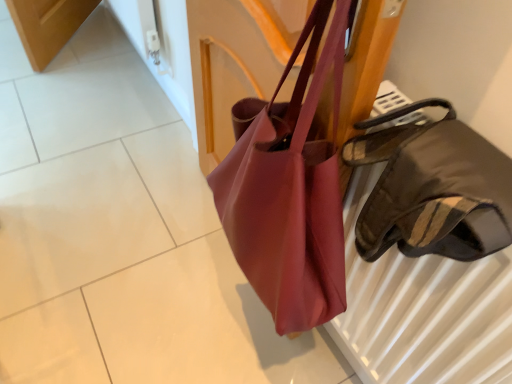
Describe the element at coordinates (290, 192) in the screenshot. I see `matte pink tote at center, the second handbag in the front-to-back sequence` at that location.

I want to click on matte pink fabric bag at center, so click(200, 324).

Would you say matte pink fabric bag at center is part of satin brown handbag at right, which appears as the 2th handbag when viewed from the back,'s contents?

No, satin brown handbag at right, which appears as the 2th handbag when viewed from the back, does not contain matte pink fabric bag at center.

From the picture: From the image's perspective, between satin brown handbag at right, marked as the second handbag in a left-to-right arrangement, and matte pink fabric bag at center, who is located below?

matte pink fabric bag at center is shown below in the image.

Is satin brown handbag at right, which appears as the 2th handbag when viewed from the back, taller or shorter than matte pink fabric bag at center?

Considering their sizes, satin brown handbag at right, which appears as the 2th handbag when viewed from the back, has more height than matte pink fabric bag at center.

Considering the sizes of objects matte pink tote at center, marked as the 1th handbag in a left-to-right arrangement, and satin brown handbag at right, marked as the second handbag in a left-to-right arrangement, in the image provided, who is thinner, matte pink tote at center, marked as the 1th handbag in a left-to-right arrangement, or satin brown handbag at right, marked as the second handbag in a left-to-right arrangement,?

Thinner between the two is matte pink tote at center, marked as the 1th handbag in a left-to-right arrangement.

Is point (240, 219) positioned before point (450, 234)?

No, (240, 219) is further to viewer.

Is matte pink tote at center, the second handbag when ordered from right to left, far from satin brown handbag at right, positioned as the 1th handbag in right-to-left order?

No, there isn't a large distance between matte pink tote at center, the second handbag when ordered from right to left, and satin brown handbag at right, positioned as the 1th handbag in right-to-left order.

Consider the image. Is matte pink tote at center, the first handbag positioned from the back, closer to the viewer compared to satin brown handbag at right, marked as the second handbag in a left-to-right arrangement?

No, the depth of matte pink tote at center, the first handbag positioned from the back, is greater than that of satin brown handbag at right, marked as the second handbag in a left-to-right arrangement.

From a real-world perspective, does matte pink fabric bag at center sit lower than matte pink tote at center, the first handbag positioned from the back?

Correct, in the physical world, matte pink fabric bag at center is lower than matte pink tote at center, the first handbag positioned from the back.

Does matte pink fabric bag at center have a greater width compared to matte pink tote at center, the second handbag in the front-to-back sequence?

Yes.

From the image's perspective, which object appears higher, matte pink fabric bag at center or matte pink tote at center, marked as the 1th handbag in a left-to-right arrangement?

From the image's view, matte pink tote at center, marked as the 1th handbag in a left-to-right arrangement, is above.

Is point (163, 344) less distant than point (268, 177)?

No.

Is satin brown handbag at right, marked as the 1th handbag in a front-to-back arrangement, oriented away from matte pink tote at center, the second handbag when ordered from right to left?

No, satin brown handbag at right, marked as the 1th handbag in a front-to-back arrangement,'s orientation is not away from matte pink tote at center, the second handbag when ordered from right to left.

Is satin brown handbag at right, marked as the second handbag in a left-to-right arrangement, surrounding matte pink tote at center, the first handbag positioned from the back?

Actually, matte pink tote at center, the first handbag positioned from the back, is outside satin brown handbag at right, marked as the second handbag in a left-to-right arrangement.

Is satin brown handbag at right, which appears as the 2th handbag when viewed from the back, directly adjacent to matte pink tote at center, the second handbag when ordered from right to left?

satin brown handbag at right, which appears as the 2th handbag when viewed from the back, is not next to matte pink tote at center, the second handbag when ordered from right to left, and they're not touching.

Which of these two, satin brown handbag at right, which appears as the 2th handbag when viewed from the back, or matte pink tote at center, the second handbag in the front-to-back sequence, is wider?

satin brown handbag at right, which appears as the 2th handbag when viewed from the back.

From a real-world perspective, is matte pink fabric bag at center physically below satin brown handbag at right, marked as the 1th handbag in a front-to-back arrangement?

Indeed, from a real-world perspective, matte pink fabric bag at center is positioned beneath satin brown handbag at right, marked as the 1th handbag in a front-to-back arrangement.

Which object is positioned more to the left, matte pink fabric bag at center or satin brown handbag at right, which appears as the 2th handbag when viewed from the back?

From the viewer's perspective, matte pink fabric bag at center appears more on the left side.

What's the angular difference between matte pink fabric bag at center and satin brown handbag at right, positioned as the 1th handbag in right-to-left order,'s facing directions?

88.1 degrees separate the facing orientations of matte pink fabric bag at center and satin brown handbag at right, positioned as the 1th handbag in right-to-left order.

Which is less distant, (128,334) or (454,155)?

The point (454,155) is more forward.

How many degrees apart are the facing directions of matte pink tote at center, the second handbag when ordered from right to left, and matte pink fabric bag at center?

The angle between the facing direction of matte pink tote at center, the second handbag when ordered from right to left, and the facing direction of matte pink fabric bag at center is 89.5 degrees.

Is matte pink tote at center, the second handbag in the front-to-back sequence, to the left of matte pink fabric bag at center from the viewer's perspective?

No.

From a real-world perspective, which object rests below the other?

matte pink fabric bag at center.

You are a GUI agent. You are given a task and a screenshot of the screen. Output one action in this format:
    pyautogui.click(x=<x>, y=<y>)
    Task: Click on the tile below the matte pink tote at center, the second handbag in the front-to-back sequence (from the image's perspective)
    This screenshot has width=512, height=384.
    Given the screenshot: What is the action you would take?
    pyautogui.click(x=200, y=324)

The height and width of the screenshot is (384, 512). In the image, there is a satin brown handbag at right, marked as the 1th handbag in a front-to-back arrangement. Find the location of `tile below it (from a real-world perspective)`. tile below it (from a real-world perspective) is located at coordinates (200, 324).

There is a matte pink tote at center, the first handbag positioned from the back. Identify the location of handbag above it (from a real-world perspective). Image resolution: width=512 pixels, height=384 pixels. (432, 189).

From the image, which object appears to be nearer to matte pink tote at center, marked as the 1th handbag in a left-to-right arrangement, satin brown handbag at right, which appears as the 2th handbag when viewed from the back, or matte pink fabric bag at center?

satin brown handbag at right, which appears as the 2th handbag when viewed from the back, lies closer to matte pink tote at center, marked as the 1th handbag in a left-to-right arrangement, than the other object.

From the image, which object appears to be nearer to satin brown handbag at right, positioned as the 1th handbag in right-to-left order, matte pink tote at center, the second handbag in the front-to-back sequence, or matte pink fabric bag at center?

matte pink tote at center, the second handbag in the front-to-back sequence.

Considering their positions, is matte pink tote at center, the second handbag when ordered from right to left, positioned closer to matte pink fabric bag at center than satin brown handbag at right, marked as the 1th handbag in a front-to-back arrangement?

matte pink tote at center, the second handbag when ordered from right to left, is closer to matte pink fabric bag at center.

Estimate the real-world distances between objects in this image. Which object is closer to satin brown handbag at right, marked as the second handbag in a left-to-right arrangement, matte pink fabric bag at center or matte pink tote at center, marked as the 1th handbag in a left-to-right arrangement?

matte pink tote at center, marked as the 1th handbag in a left-to-right arrangement, is positioned closer to the anchor satin brown handbag at right, marked as the second handbag in a left-to-right arrangement.

Looking at the image, which one is located further to matte pink fabric bag at center, satin brown handbag at right, positioned as the 1th handbag in right-to-left order, or matte pink tote at center, the second handbag in the front-to-back sequence?

satin brown handbag at right, positioned as the 1th handbag in right-to-left order, is further to matte pink fabric bag at center.

Which object lies nearer to the anchor point matte pink tote at center, the first handbag positioned from the back, matte pink fabric bag at center or satin brown handbag at right, marked as the second handbag in a left-to-right arrangement?

satin brown handbag at right, marked as the second handbag in a left-to-right arrangement, is closer to matte pink tote at center, the first handbag positioned from the back.

The width and height of the screenshot is (512, 384). I want to click on handbag between matte pink fabric bag at center and satin brown handbag at right, marked as the second handbag in a left-to-right arrangement, from left to right, so click(290, 192).